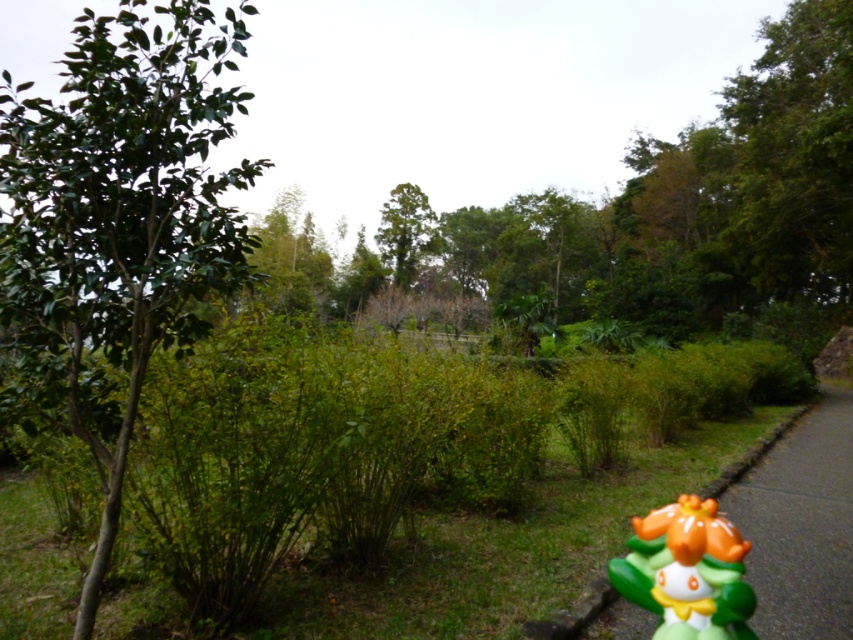
Looking at this image, you are a gardener who needs to place a new bench between the green leafy tree at left and the green rubber curb at lower right. Based on their positions, which side of the bench should face the tree?

The green leafy tree at left is to the left of green rubber curb at lower right, so the bench should be placed with its back facing the tree to allow visitors to sit facing the curb.

You are a gardener who needs to place a new small statue exactly between the green leafy tree at left and the green rubber toy at lower right. Considering their sizes, which object will the statue be closer to?

The statue will be closer to the green rubber toy at lower right because the green leafy tree at left is larger in size, meaning the distance between them would require the statue to be placed nearer to the smaller object to maintain balance.